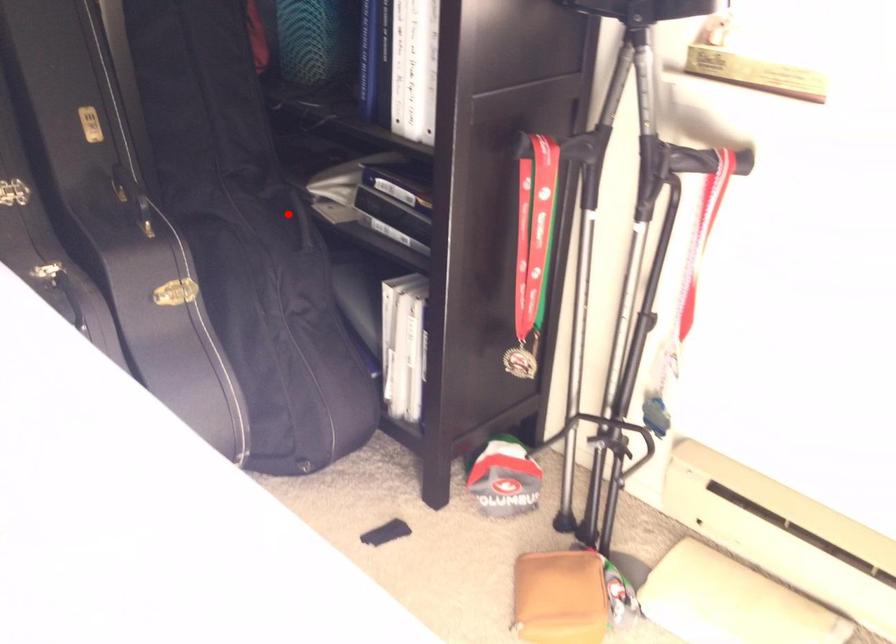
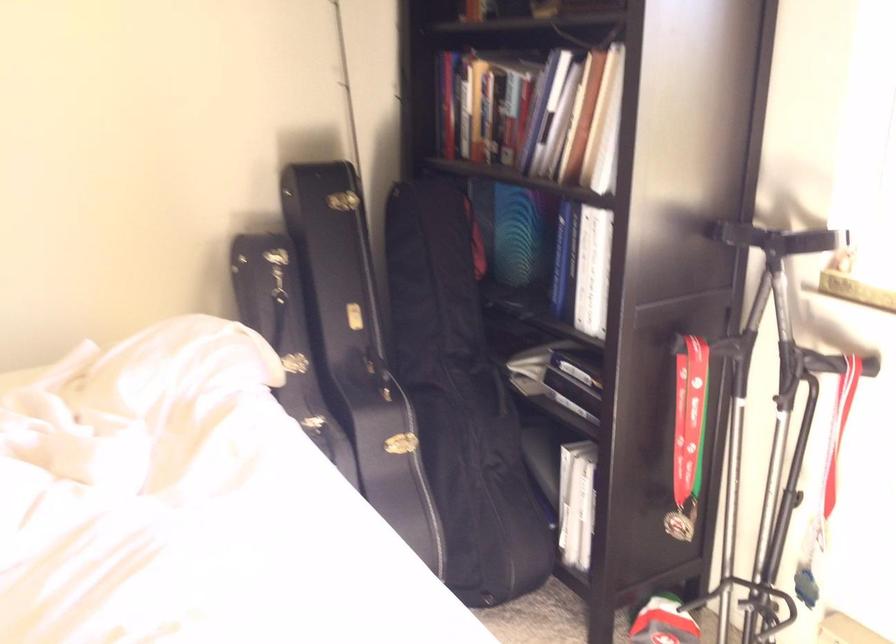
Question: I am providing you with two images of the same scene from different viewpoints. In image1, a red point is highlighted. Considering the same 3D point in image2, which of the following is correct?

Choices:
 (A) It is closer
 (B) It is farther

Answer: (B)